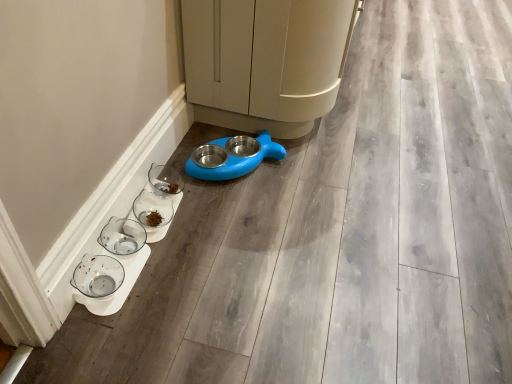
At what (x,y) coordinates should I click in order to perform the action: click on free space between blue plastic bowl at lower center and blue plastic pet feeder at center. Please return your answer as a coordinate pair (x, y). This screenshot has width=512, height=384. Looking at the image, I should click on pos(253,170).